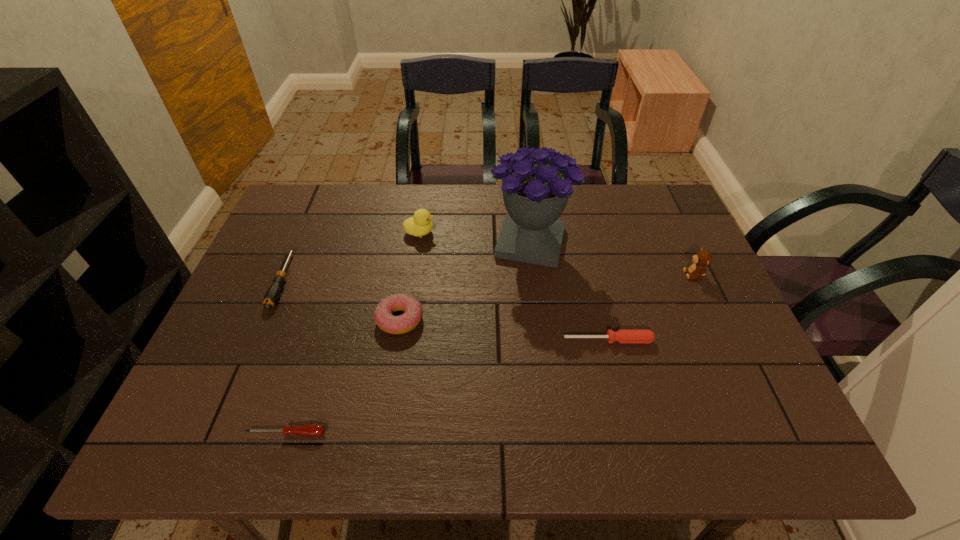
Where is `vacant region located 0.260m on the right of the bouquet`? Image resolution: width=960 pixels, height=540 pixels. vacant region located 0.260m on the right of the bouquet is located at coordinates (659, 242).

The width and height of the screenshot is (960, 540). In order to click on vacant space located 0.080m on the face of the rightmost object in this screenshot , I will do `click(655, 274)`.

The image size is (960, 540). In order to click on vacant space situated on the face of the rightmost object in this screenshot , I will do click(648, 274).

I want to click on free space located 0.270m on the face of the rightmost object, so click(x=586, y=274).

Find the location of a particular element. free space located 0.160m at the beak of the duckling is located at coordinates (488, 232).

This screenshot has height=540, width=960. I want to click on vacant area situated on the front of the fourth tallest object, so click(388, 395).

This screenshot has height=540, width=960. I want to click on free location located on the back of the leftmost object, so click(310, 217).

Locate an element on the screen. The image size is (960, 540). free spot located 0.270m on the left of the second shortest object is located at coordinates (451, 340).

Where is `vacant area located 0.310m on the back of the nearest object`? vacant area located 0.310m on the back of the nearest object is located at coordinates pyautogui.click(x=325, y=311).

This screenshot has width=960, height=540. I want to click on bouquet positioned at the far edge, so click(x=536, y=183).